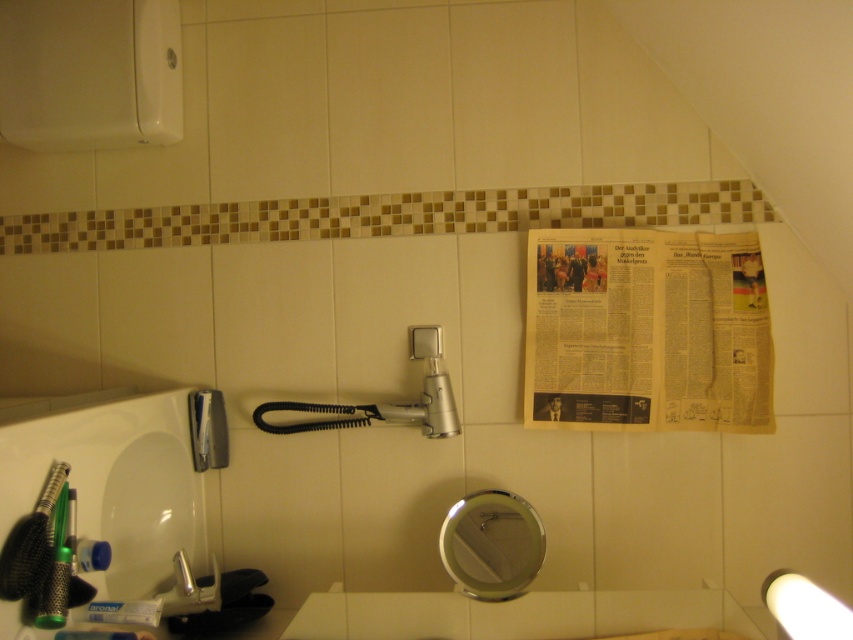
Is yellowed newspaper at upper right shorter than white plastic toothpaste at lower left?

No.

Which of these two, yellowed newspaper at upper right or white plastic toothpaste at lower left, stands shorter?

Standing shorter between the two is white plastic toothpaste at lower left.

Identify the location of yellowed newspaper at upper right. (647, 332).

Where is `yellowed newspaper at upper right`? yellowed newspaper at upper right is located at coordinates (647, 332).

Is white glossy sink at lower left shorter than white plastic toothpaste at lower left?

In fact, white glossy sink at lower left may be taller than white plastic toothpaste at lower left.

Is point (144, 522) farther from camera compared to point (70, 636)?

Yes, point (144, 522) is behind point (70, 636).

Does point (123, 531) lie behind point (61, 628)?

That is True.

Find the location of a particular element. This screenshot has width=853, height=640. white glossy sink at lower left is located at coordinates (103, 508).

Which is above, yellowed newspaper at upper right or white glossy sink at lower left?

Positioned higher is yellowed newspaper at upper right.

Based on the photo, can you confirm if yellowed newspaper at upper right is positioned above white glossy sink at lower left?

Yes.

Does point (703, 234) come farther from viewer compared to point (93, 493)?

Yes, point (703, 234) is behind point (93, 493).

Identify the location of yellowed newspaper at upper right. (647, 332).